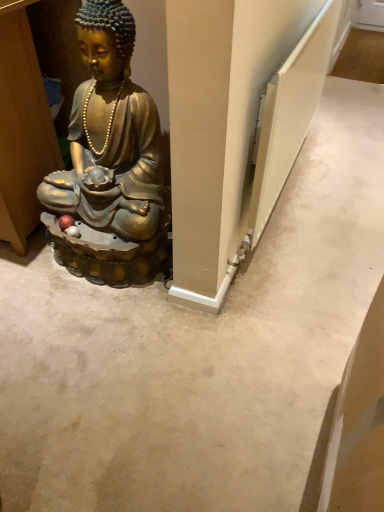
Locate an element on the screen. The height and width of the screenshot is (512, 384). vacant space in white textured radiator at right (from a real-world perspective) is located at coordinates point(290,183).